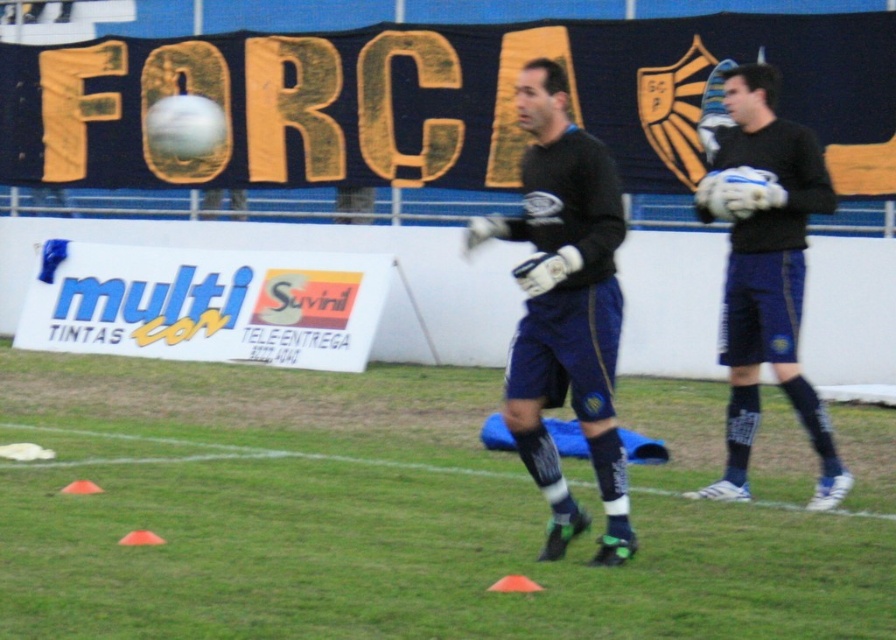
Who is positioned more to the left, dark blue jersey at center or matte black gloves at right?

dark blue jersey at center is more to the left.

Does dark blue jersey at center have a lesser width compared to matte black gloves at right?

Yes.

Where is `dark blue jersey at center`? The image size is (896, 640). dark blue jersey at center is located at coordinates (565, 308).

Does point (481, 472) lie in front of point (738, 298)?

No.

Does green grass at center lie in front of matte black gloves at right?

Yes, green grass at center is in front of matte black gloves at right.

Who is more distant from viewer, (14, 481) or (786, 352)?

The point (14, 481) is behind.

Locate an element on the screen. The width and height of the screenshot is (896, 640). green grass at center is located at coordinates (393, 513).

Is point (785, 577) positioned in front of point (586, 284)?

Yes.

The width and height of the screenshot is (896, 640). What are the coordinates of `green grass at center` in the screenshot? It's located at (393, 513).

Is point (655, 403) positioned after point (613, 541)?

Yes, it is.

Where is `green grass at center`? green grass at center is located at coordinates (393, 513).